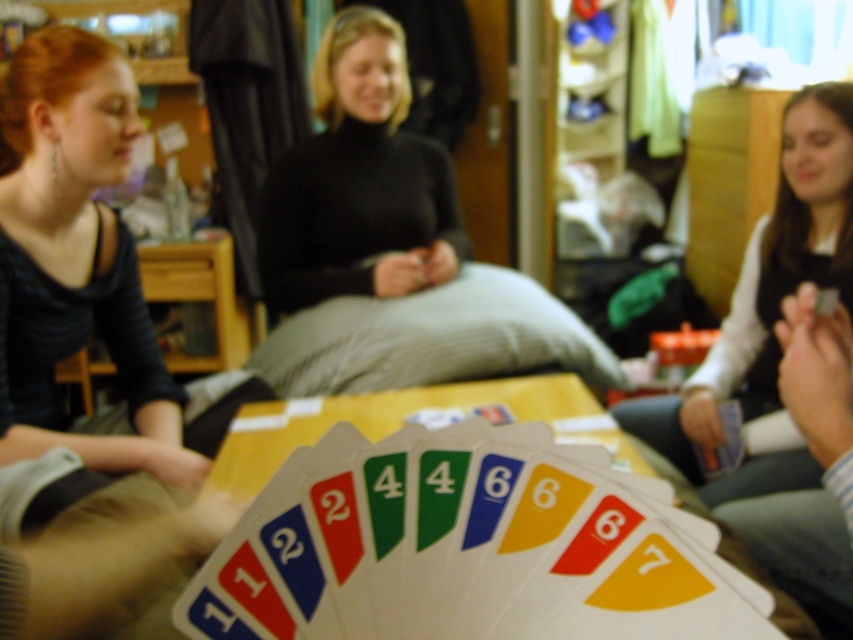
Question: Where is smooth plastic cards at center located in relation to smooth black card at right in the image?

Choices:
 (A) right
 (B) left

Answer: (B)

Question: Does black turtleneck sweater at center appear on the right side of smooth black card at right?

Choices:
 (A) yes
 (B) no

Answer: (B)

Question: Which point appears farthest from the camera in this image?

Choices:
 (A) (410, 596)
 (B) (784, 216)

Answer: (B)

Question: Which of the following is the closest to the observer?

Choices:
 (A) black turtleneck sweater at center
 (B) smooth plastic cards at center
 (C) matte black shirt at left

Answer: (B)

Question: Can you confirm if smooth plastic cards at center is wider than black turtleneck sweater at center?

Choices:
 (A) no
 (B) yes

Answer: (A)

Question: Which of the following is the closest to the observer?

Choices:
 (A) smooth black card at right
 (B) matte black shirt at left
 (C) black turtleneck sweater at center
 (D) smooth plastic cards at center

Answer: (D)